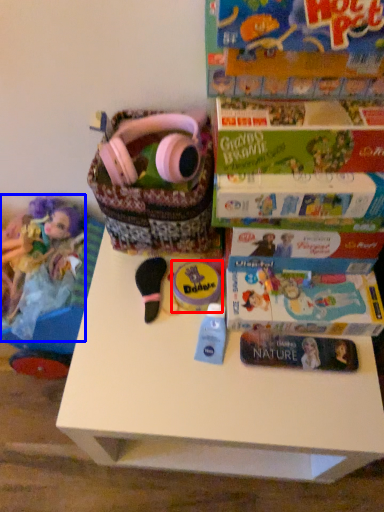
Question: Which point is closer to the camera, toy (highlighted by a red box) or doll (highlighted by a blue box)?

Choices:
 (A) toy
 (B) doll

Answer: (A)